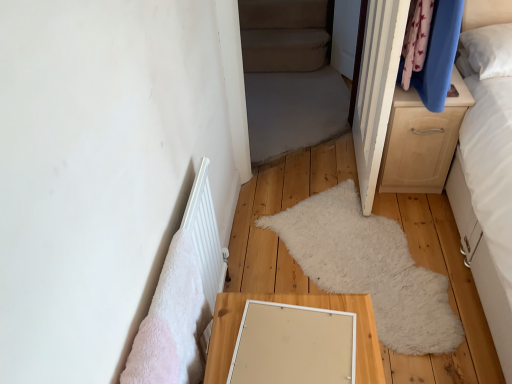
You are a GUI agent. You are given a task and a screenshot of the screen. Output one action in this format:
    pyautogui.click(x=<x>, y=<y>)
    Task: Click on the blank space situated above light wood/texture table at lower center (from a real-world perspective)
    
    Given the screenshot: What is the action you would take?
    click(x=291, y=328)